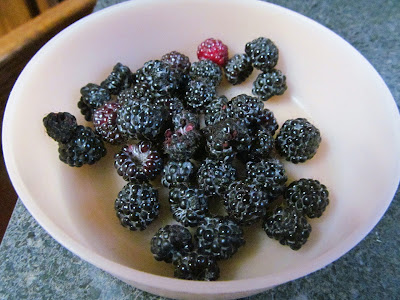
You are a GUI agent. You are given a task and a screenshot of the screen. Output one action in this format:
    pyautogui.click(x=<x>, y=<y>)
    Task: Click on the green counter behind bowl
    Image resolution: width=400 pixels, height=300 pixels.
    Given the screenshot: What is the action you would take?
    pyautogui.click(x=385, y=263)